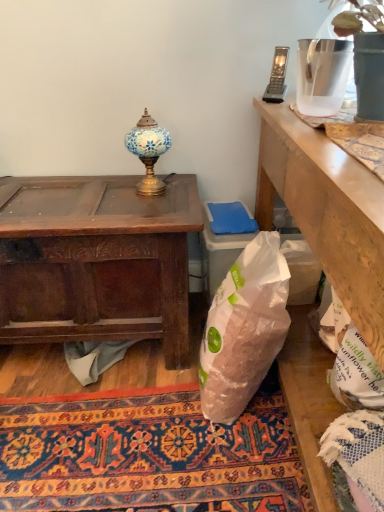
At what (x,y) coordinates should I click in order to perform the action: click on free space in front of translucent plastic bag at center. Please return your answer as a coordinate pair (x, y). The height and width of the screenshot is (512, 384). Looking at the image, I should click on (228, 462).